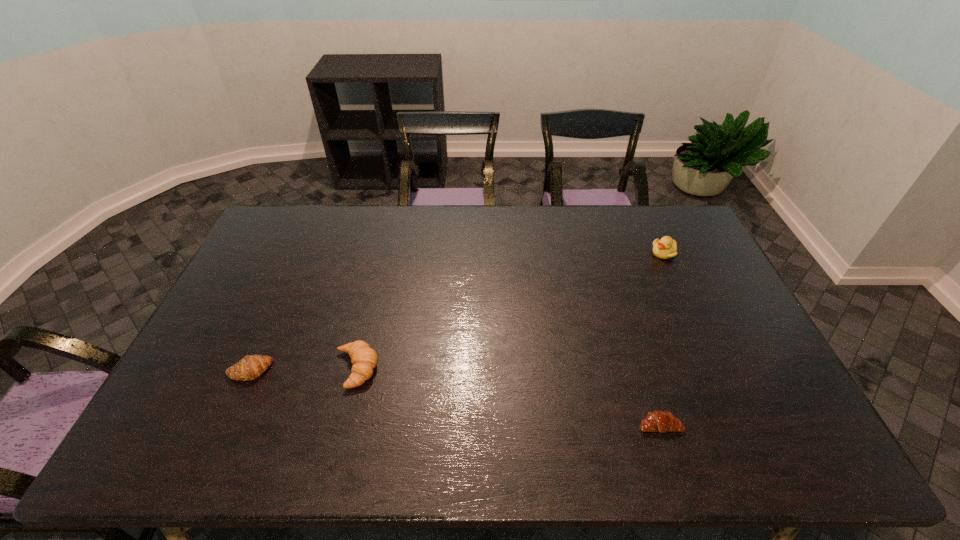
This screenshot has width=960, height=540. I want to click on free space in the image that satisfies the following two spatial constraints: 1. on the back side of the second shortest object; 2. on the left side of the tallest crescent roll, so click(x=251, y=369).

Locate an element on the screen. This screenshot has width=960, height=540. vacant point that satisfies the following two spatial constraints: 1. on the back side of the third shortest object; 2. on the right side of the second shortest object is located at coordinates (251, 369).

At what (x,y) coordinates should I click in order to perform the action: click on free space that satisfies the following two spatial constraints: 1. on the beak of the tallest object; 2. on the front side of the nearest object. Please return your answer as a coordinate pair (x, y). This screenshot has height=540, width=960. Looking at the image, I should click on (742, 424).

You are a GUI agent. You are given a task and a screenshot of the screen. Output one action in this format:
    pyautogui.click(x=<x>, y=<y>)
    Task: Click on the free point that satisfies the following two spatial constraints: 1. on the back side of the second tallest crescent roll; 2. on the right side of the second crescent roll from left to right
    
    Given the screenshot: What is the action you would take?
    pyautogui.click(x=251, y=369)